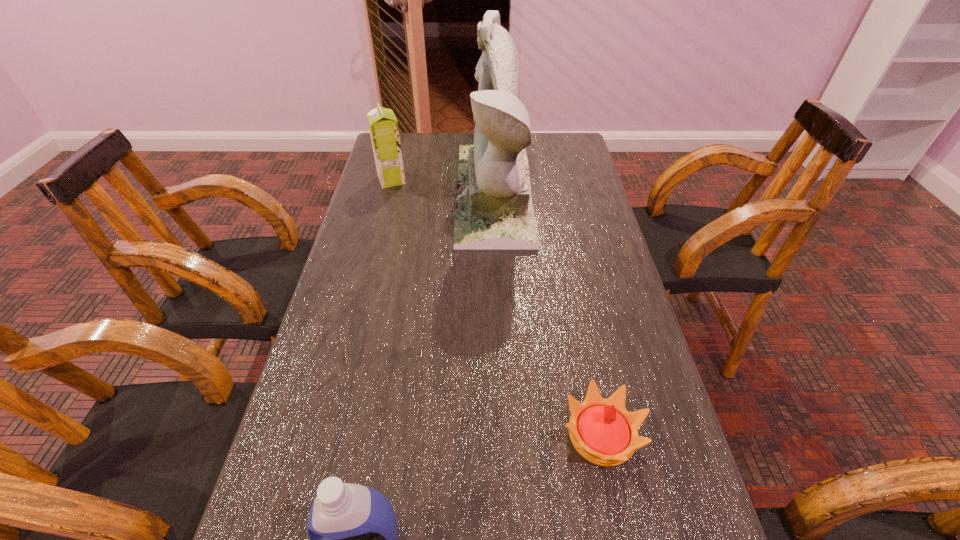
I want to click on object present at the left edge, so click(383, 126).

Identify the location of object positioned at the right edge. This screenshot has height=540, width=960. (x=602, y=431).

Find the location of `free region at the far edge`. free region at the far edge is located at coordinates (466, 132).

Identify the location of vacant space at the left edge of the desktop. (371, 177).

Image resolution: width=960 pixels, height=540 pixels. I want to click on free spot at the right edge of the desktop, so click(646, 399).

Find the location of a particular element. The width and height of the screenshot is (960, 540). vacant area at the far right corner is located at coordinates (552, 133).

Find the location of `vacant area that lies between the soya milk and the second nearest object`. vacant area that lies between the soya milk and the second nearest object is located at coordinates (496, 308).

Identify the location of free spot between the crown and the sculpture. tap(547, 315).

At what (x,y) coordinates should I click in order to perform the action: click on vacant region between the shortest object and the soya milk. Please return your answer as a coordinate pair (x, y). The height and width of the screenshot is (540, 960). Looking at the image, I should click on (496, 308).

Find the location of a particular element. This screenshot has width=960, height=540. free space between the soya milk and the third farthest object is located at coordinates (496, 308).